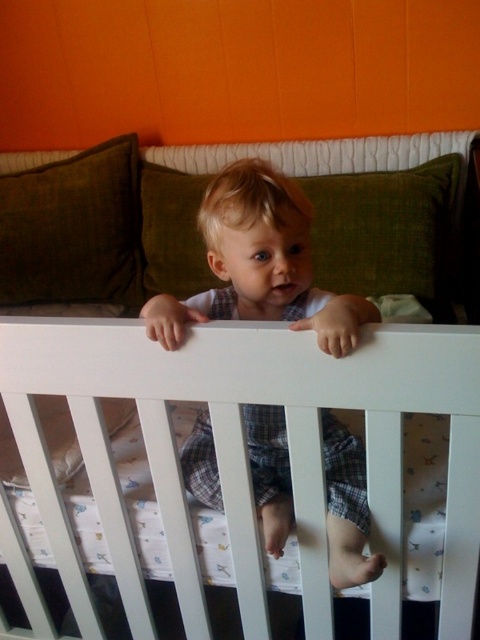
Can you confirm if green fabric pillow at upper center is taller than green fabric pillow at upper left?

No.

Who is lower down, green fabric pillow at upper center or green fabric pillow at upper left?

green fabric pillow at upper center is lower down.

This screenshot has width=480, height=640. I want to click on green fabric pillow at upper center, so click(x=386, y=228).

What are the coordinates of `green fabric pillow at upper center` in the screenshot? It's located at (386, 228).

What do you see at coordinates (260, 264) in the screenshot? The height and width of the screenshot is (640, 480). I see `plaid fabric toddler at center` at bounding box center [260, 264].

Can you confirm if plaid fabric toddler at center is thinner than green fabric pillow at upper left?

Correct, plaid fabric toddler at center's width is less than green fabric pillow at upper left's.

Locate an element on the screen. This screenshot has height=640, width=480. plaid fabric toddler at center is located at coordinates (260, 264).

Identify the location of plaid fabric toddler at center. (260, 264).

Can you confirm if plaid fabric toddler at center is shorter than green fabric pillow at upper center?

No, plaid fabric toddler at center is not shorter than green fabric pillow at upper center.

Who is more distant from viewer, (173, 305) or (359, 193)?

Positioned behind is point (359, 193).

Find the location of a particular element. Image resolution: width=480 pixels, height=640 pixels. plaid fabric toddler at center is located at coordinates (260, 264).